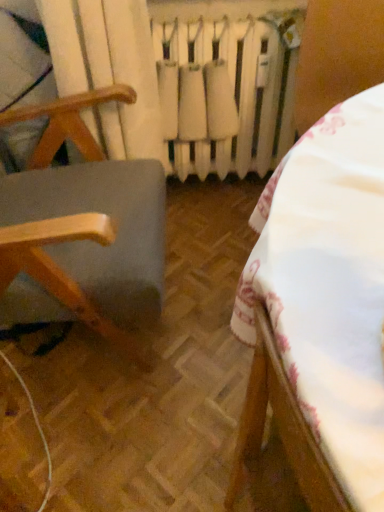
I want to click on vacant area that lies in front of wooden chair at left, positioned as the first furniture in left-to-right order, so click(x=100, y=440).